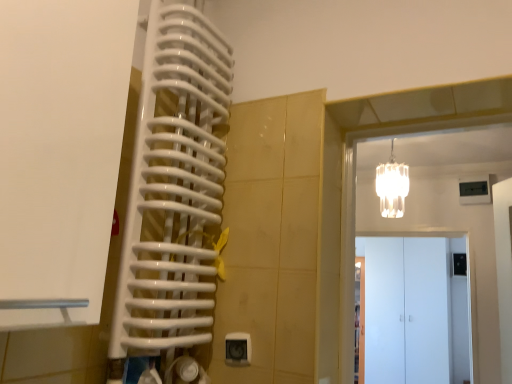
Question: From the image's perspective, is white matte door at left, placed as the 1th door when sorted from left to right, below white matte cabinet at center, acting as the second door starting from the right?

Choices:
 (A) yes
 (B) no

Answer: (B)

Question: Is white matte door at left, marked as the first door in a top-to-bottom arrangement, facing towards white matte cabinet at center, acting as the second door starting from the right?

Choices:
 (A) yes
 (B) no

Answer: (B)

Question: Does white matte door at left, placed as the 1th door when sorted from left to right, have a smaller size compared to white matte cabinet at center, the 2th door when ordered from left to right?

Choices:
 (A) yes
 (B) no

Answer: (B)

Question: Does white matte door at left, which appears as the third door when viewed from the back, have a lesser height compared to white matte cabinet at center, the 2th door when ordered from left to right?

Choices:
 (A) no
 (B) yes

Answer: (B)

Question: Does white matte door at left, the 3th door viewed from the right, contain white matte cabinet at center, acting as the second door starting from the right?

Choices:
 (A) no
 (B) yes

Answer: (A)

Question: Looking at the image, does white glass chandelier at upper right seem bigger or smaller compared to white matte door at left, the 3th door viewed from the right?

Choices:
 (A) small
 (B) big

Answer: (A)

Question: In the image, is white glass chandelier at upper right on the left side or the right side of white matte door at left, marked as the 1th door in a front-to-back arrangement?

Choices:
 (A) right
 (B) left

Answer: (A)

Question: In terms of height, does white glass chandelier at upper right look taller or shorter compared to white matte door at left, placed as the 1th door when sorted from left to right?

Choices:
 (A) short
 (B) tall

Answer: (A)

Question: Considering their positions, is white glass chandelier at upper right located in front of or behind white matte door at left, marked as the first door in a top-to-bottom arrangement?

Choices:
 (A) behind
 (B) front

Answer: (A)

Question: Is white matte door at left, marked as the first door in a top-to-bottom arrangement, taller or shorter than white glass chandelier at upper right?

Choices:
 (A) short
 (B) tall

Answer: (B)

Question: In terms of width, does white matte door at left, marked as the 1th door in a front-to-back arrangement, look wider or thinner when compared to white glass chandelier at upper right?

Choices:
 (A) wide
 (B) thin

Answer: (A)

Question: Does point (x=113, y=109) appear closer or farther from the camera than point (x=375, y=183)?

Choices:
 (A) closer
 (B) farther

Answer: (A)

Question: In the image, is white matte door at left, which appears as the third door when viewed from the back, positioned in front of or behind white glass chandelier at upper right?

Choices:
 (A) front
 (B) behind

Answer: (A)

Question: Considering the positions of point (83, 132) and point (357, 345), is point (83, 132) closer or farther from the camera than point (357, 345)?

Choices:
 (A) farther
 (B) closer

Answer: (B)

Question: In the image, is white matte door at left, marked as the 1th door in a front-to-back arrangement, positioned in front of or behind white glossy door at right, the third door from the front?

Choices:
 (A) front
 (B) behind

Answer: (A)